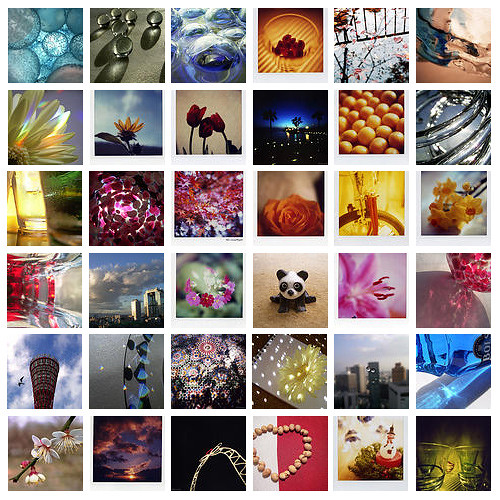
Find the location of `boxes in third row from left`. boxes in third row from left is located at coordinates (218, 460), (210, 376), (211, 288), (214, 212), (211, 135), (214, 39).